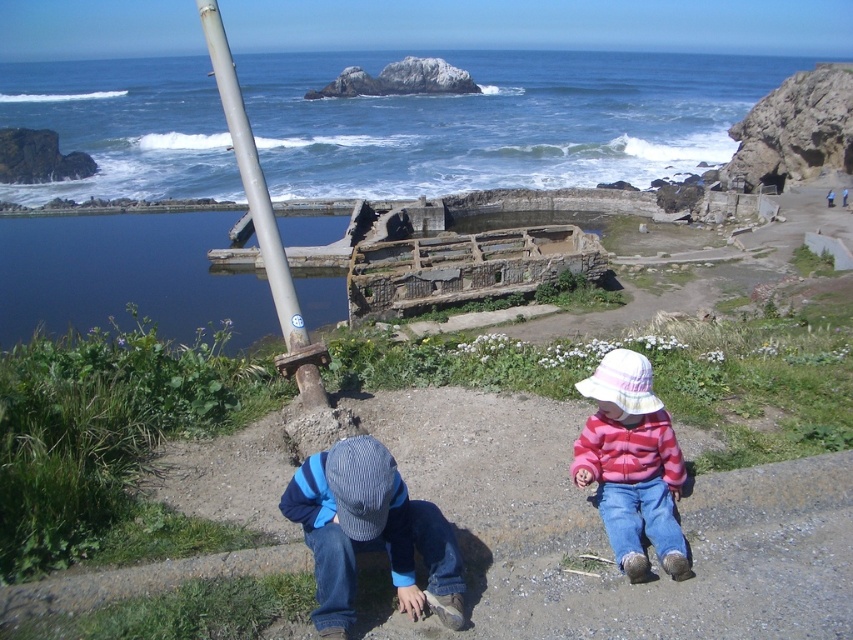
Is smooth dirt path at center behind silver metallic pole at upper left?

That is False.

Between smooth dirt path at center and silver metallic pole at upper left, which one is positioned lower?

smooth dirt path at center is below.

What do you see at coordinates (694, 564) in the screenshot? The height and width of the screenshot is (640, 853). I see `smooth dirt path at center` at bounding box center [694, 564].

Locate an element on the screen. This screenshot has height=640, width=853. smooth dirt path at center is located at coordinates (694, 564).

Who is more forward, (x=604, y=419) or (x=288, y=333)?

Point (x=604, y=419)

Is point (666, 564) closer to camera compared to point (287, 269)?

Yes, point (666, 564) is in front of point (287, 269).

At what (x,y) coordinates should I click in order to perform the action: click on pink fleece jacket at lower right. Please return your answer as a coordinate pair (x, y). Looking at the image, I should click on (631, 465).

Is blue water at upper center smaller than silver metallic pole at upper left?

No.

Between point (111, 196) and point (289, 352), which one is positioned behind?

The point (111, 196) is more distant.

Identify the location of blue water at upper center. This screenshot has width=853, height=640. (500, 120).